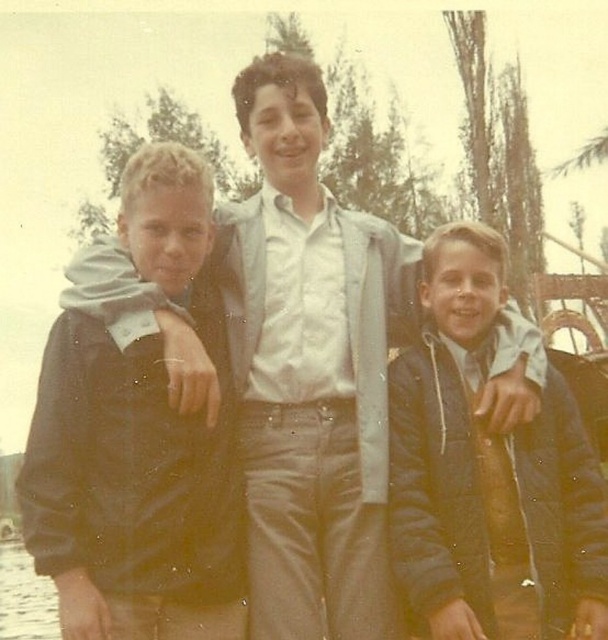
Question: Which object is closer to the camera taking this photo?

Choices:
 (A) dark blue jacket at center
 (B) clear water at lower left

Answer: (A)

Question: Which of the following is the farthest from the observer?

Choices:
 (A) (72, 504)
 (B) (9, 616)

Answer: (B)

Question: Among these objects, which one is nearest to the camera?

Choices:
 (A) clear water at lower left
 (B) dark brown leather jacket at left

Answer: (B)

Question: Is dark blue jacket at center to the left of clear water at lower left from the viewer's perspective?

Choices:
 (A) yes
 (B) no

Answer: (B)

Question: Is dark brown leather jacket at left positioned behind dark blue jacket at center?

Choices:
 (A) yes
 (B) no

Answer: (B)

Question: From the image, what is the correct spatial relationship of dark blue jacket at center in relation to clear water at lower left?

Choices:
 (A) left
 (B) right

Answer: (B)